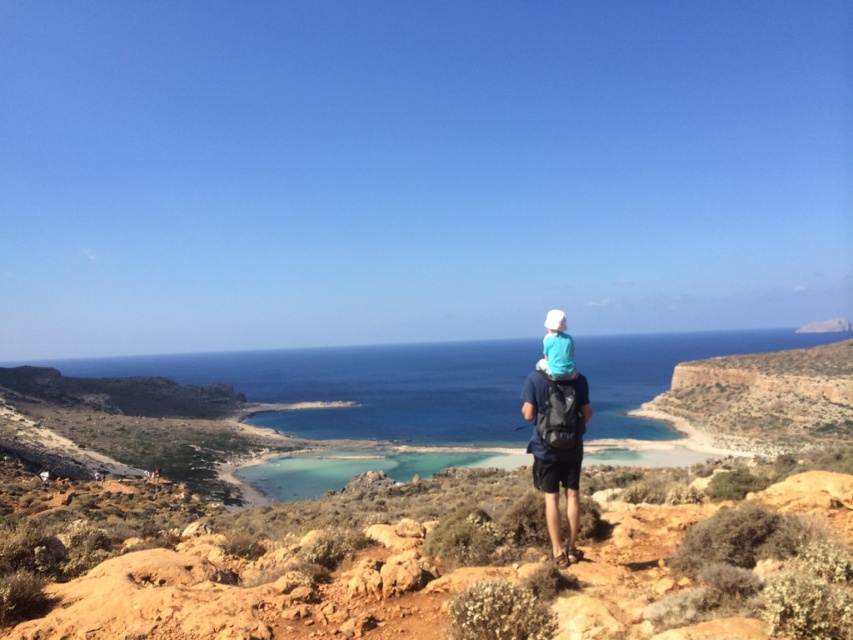
Can you confirm if clear blue water at center is positioned to the left of blue fabric backpack at center?

Indeed, clear blue water at center is positioned on the left side of blue fabric backpack at center.

Who is more forward, (331,472) or (526,403)?

Point (526,403)

Is point (310, 381) more distant than point (577, 376)?

Yes, it is behind point (577, 376).

The image size is (853, 640). Find the location of `clear blue water at center`. clear blue water at center is located at coordinates (361, 403).

Which is more to the right, clear blue water at center or white matte hat at center?

white matte hat at center is more to the right.

Which of these two, clear blue water at center or white matte hat at center, stands taller?

clear blue water at center is taller.

What do you see at coordinates (361, 403) in the screenshot? I see `clear blue water at center` at bounding box center [361, 403].

The width and height of the screenshot is (853, 640). I want to click on clear blue water at center, so click(x=361, y=403).

Does point (552, 532) come in front of point (570, 349)?

Yes, it is.

Which is behind, point (577, 468) or point (546, 316)?

The point (546, 316) is behind.

Where is `blue fabric backpack at center`? The width and height of the screenshot is (853, 640). blue fabric backpack at center is located at coordinates (561, 476).